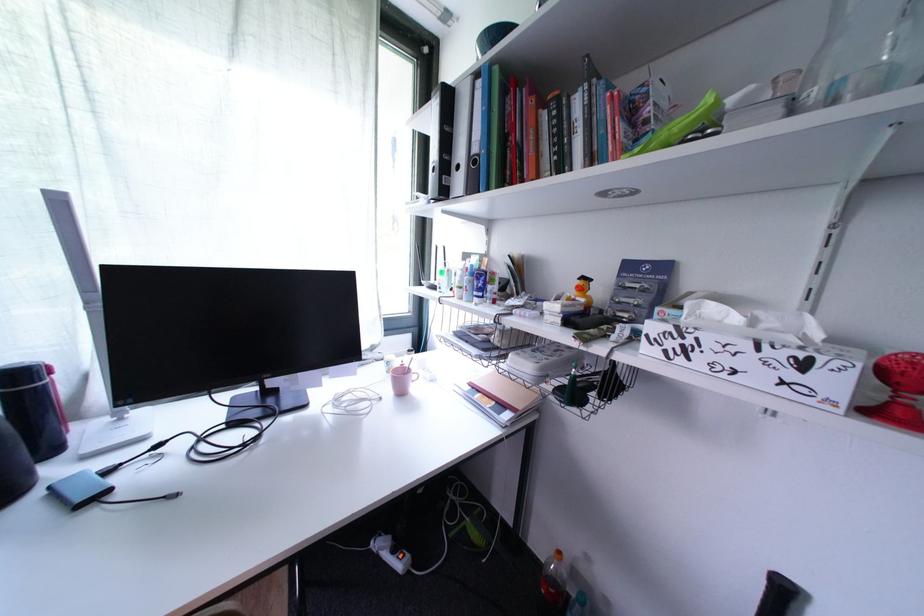
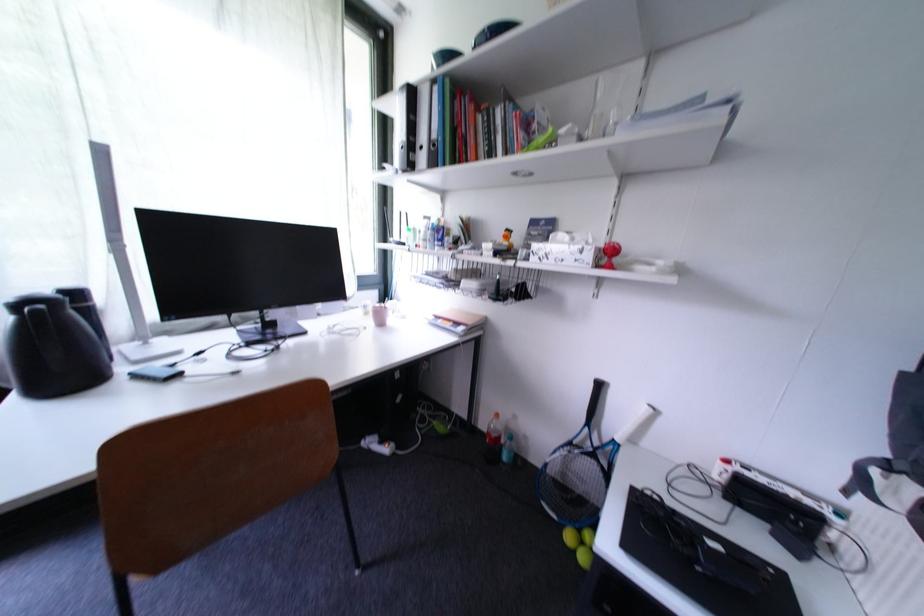
Find the pixel in the second image that matches [396,374] in the first image.

(373, 315)